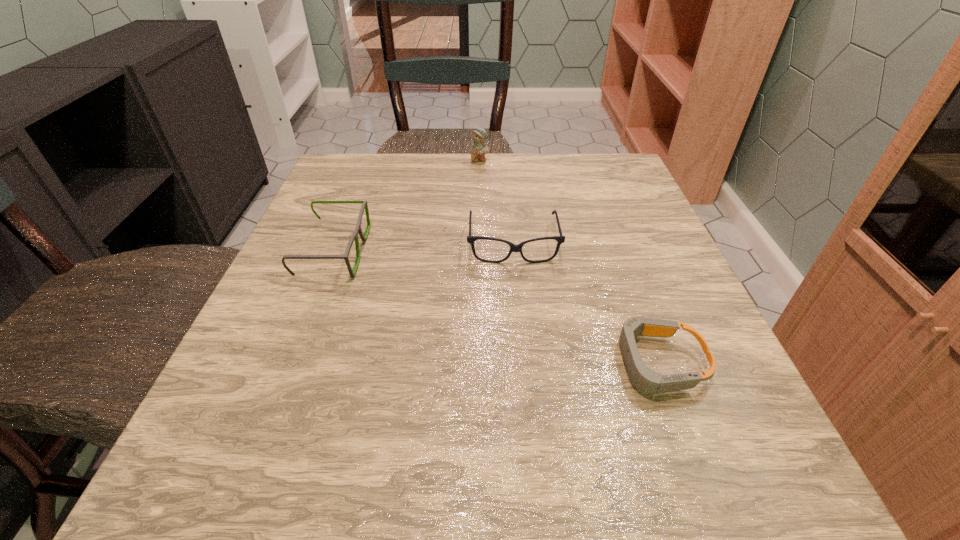
Identify the location of teddy bear. The width and height of the screenshot is (960, 540). (478, 148).

Identify the location of the tallest object. (478, 148).

Identify the location of the left spectacles. The image size is (960, 540). (358, 229).

Locate an element on the screen. The image size is (960, 540). the right spectacles is located at coordinates (560, 239).

You are a GUI agent. You are given a task and a screenshot of the screen. Output one action in this format:
    pyautogui.click(x=<x>, y=<y>)
    Task: Click on the goggles
    The height and width of the screenshot is (540, 960).
    Given the screenshot: What is the action you would take?
    pyautogui.click(x=645, y=380)

Where is `the rightmost object`? The image size is (960, 540). the rightmost object is located at coordinates (645, 380).

Where is `blank space located on the front-facing side of the tallest object`? blank space located on the front-facing side of the tallest object is located at coordinates (480, 234).

Identify the location of vacant space located 0.180m on the lens of the leftmost object. (460, 252).

Locate an element on the screen. The image size is (960, 540). free spot located on the front-facing side of the right spectacles is located at coordinates (528, 413).

This screenshot has height=540, width=960. Find the location of `vacant area situated 0.340m on the front and back of the goggles`. vacant area situated 0.340m on the front and back of the goggles is located at coordinates (373, 363).